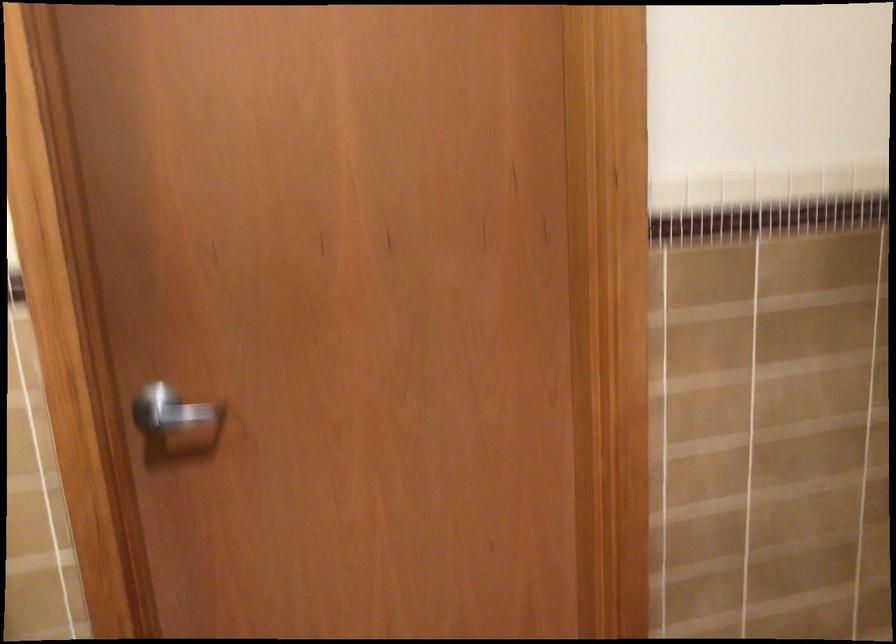
Describe the element at coordinates (170, 412) in the screenshot. I see `the metal door handle` at that location.